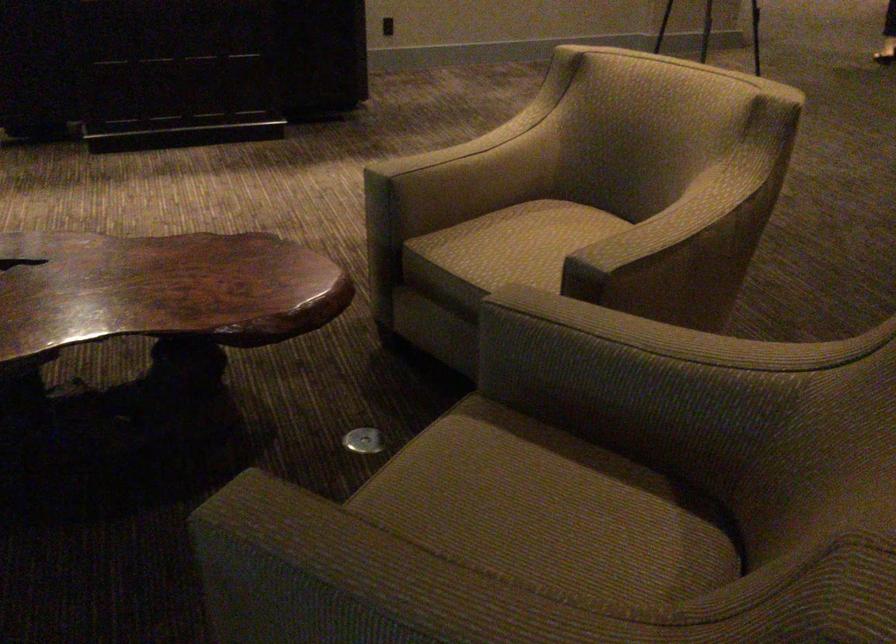
This screenshot has width=896, height=644. In order to click on chair armrest in this screenshot , I will do `click(631, 330)`.